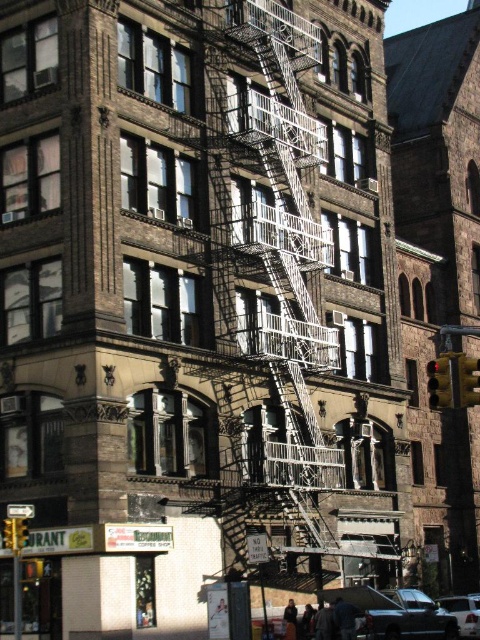
Question: Is metallic yellow traffic light at right positioned at the back of yellow-green glass traffic light at right?

Choices:
 (A) yes
 (B) no

Answer: (B)

Question: Which point is closer to the camera taking this photo?

Choices:
 (A) (477, 596)
 (B) (440, 392)

Answer: (B)

Question: Does metallic yellow traffic light at right appear on the left side of yellow metallic traffic light at lower left?

Choices:
 (A) no
 (B) yes

Answer: (A)

Question: Which object appears farthest from the camera in this image?

Choices:
 (A) yellow-green glass traffic light at right
 (B) yellow metallic traffic light at lower left
 (C) yellow plastic traffic light at lower left
 (D) metallic yellow traffic light at right

Answer: (B)

Question: Which point appears closest to the camera in this image?

Choices:
 (A) (12, 518)
 (B) (457, 627)
 (C) (24, 528)
 (D) (365, 632)

Answer: (A)

Question: Is shiny black car at lower right bigger than metallic yellow traffic light at right?

Choices:
 (A) yes
 (B) no

Answer: (A)